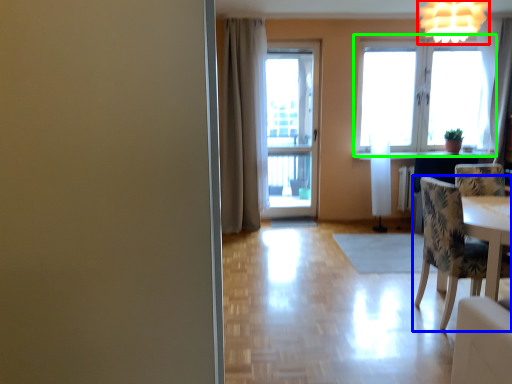
Question: Estimate the real-world distances between objects in this image. Which object is farther from light fixture (highlighted by a red box), chair (highlighted by a blue box) or window (highlighted by a green box)?

Choices:
 (A) chair
 (B) window

Answer: (B)